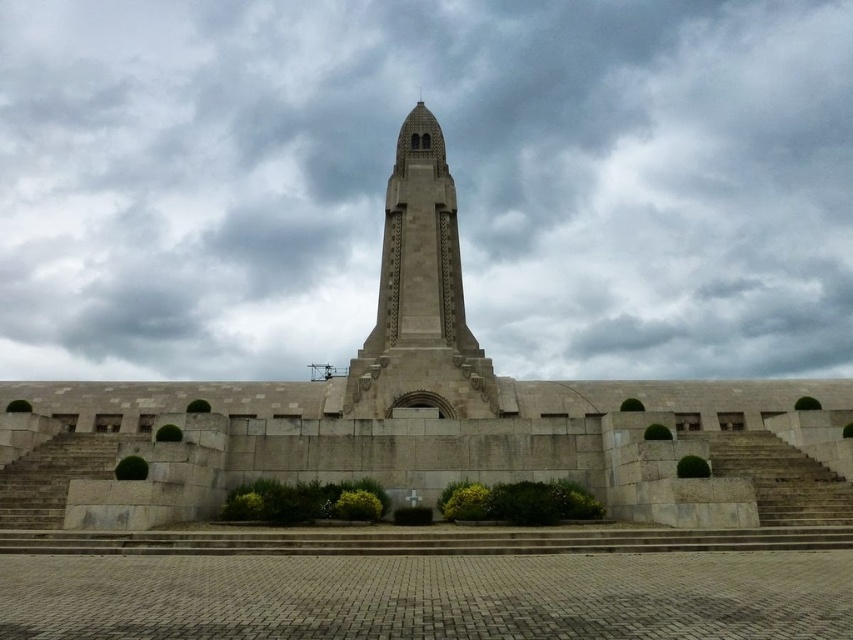
You are standing on the plaza in front of the monument. You want to climb the stairs to reach the beige stone bell tower at center. Are the gray stone stairs at center located in a position that allows you to access the tower?

The gray stone stairs at center is behind the beige stone bell tower at center, so they are positioned behind the tower rather than leading up to it. Therefore, the stairs are not in a location that provides direct access to the tower.